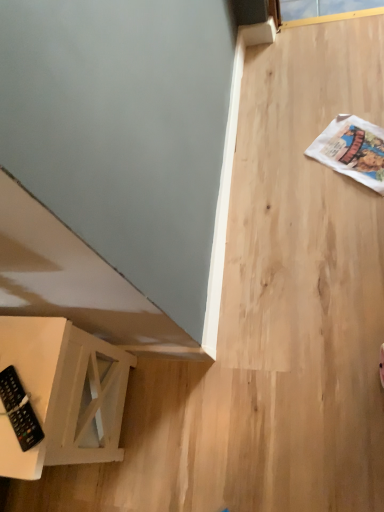
Locate an element on the screen. This screenshot has height=512, width=384. vacant area that is in front of white wood side table at lower left is located at coordinates (142, 473).